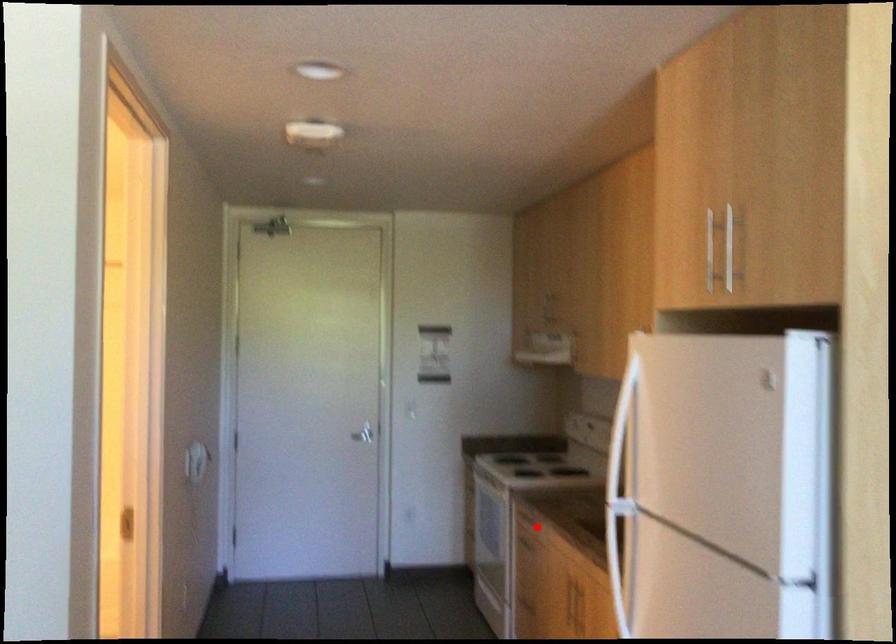
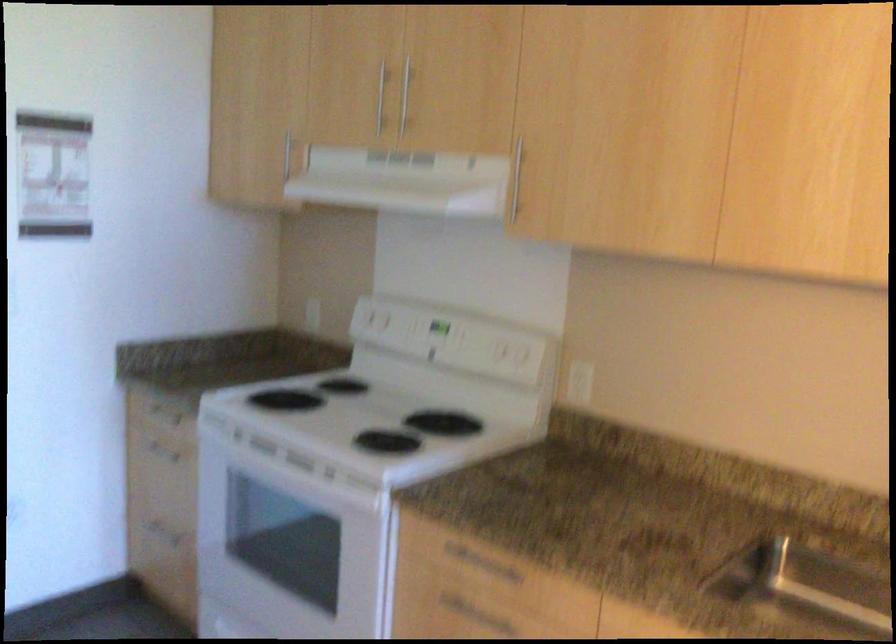
Question: A red point is marked in image1. In image2, is the corresponding 3D point closer to the camera or farther? Reply with the corresponding letter.

Choices:
 (A) The corresponding 3D point is closer.
 (B) The corresponding 3D point is farther.

Answer: (A)